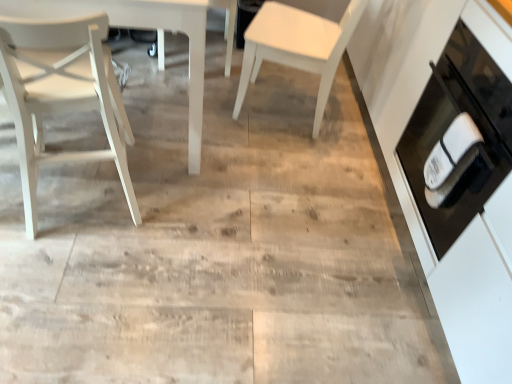
I want to click on free space in front of white matte chair at center, the third chair when ordered from left to right, so coord(301,177).